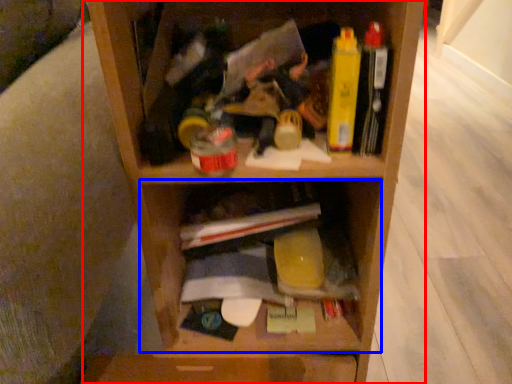
Question: Which of the following is the farthest to the observer, shelf (highlighted by a red box) or cabinet (highlighted by a blue box)?

Choices:
 (A) shelf
 (B) cabinet

Answer: (B)